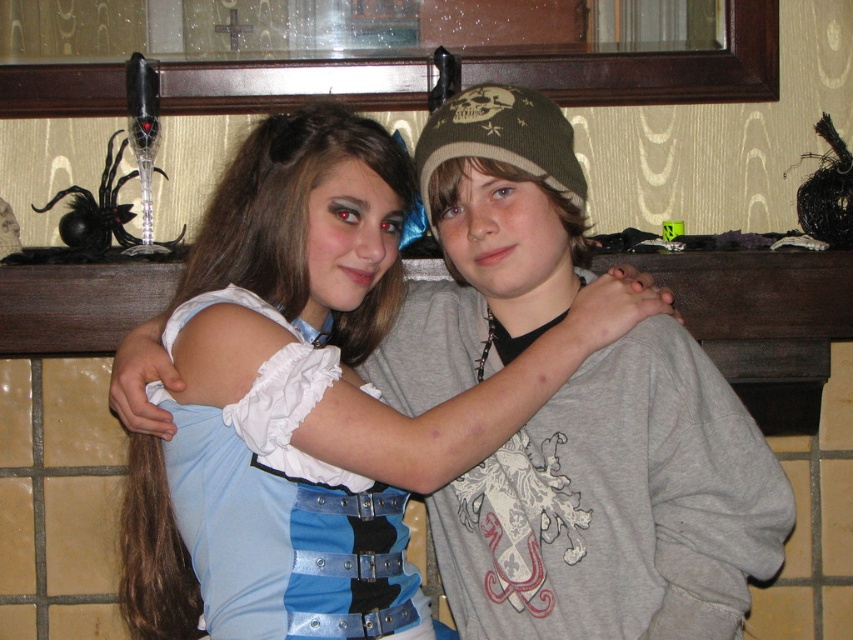
Question: Is blue satin dress at center wider than light blue fabric dress at center?

Choices:
 (A) no
 (B) yes

Answer: (B)

Question: Is gray cotton sweatshirt at center bigger than blue satin dress at center?

Choices:
 (A) no
 (B) yes

Answer: (A)

Question: Considering the relative positions of gray cotton sweatshirt at center and blue satin dress at center in the image provided, where is gray cotton sweatshirt at center located with respect to blue satin dress at center?

Choices:
 (A) left
 (B) right

Answer: (B)

Question: Which of the following is the closest to the observer?

Choices:
 (A) tap(239, 236)
 (B) tap(665, 525)

Answer: (A)

Question: Estimate the real-world distances between objects in this image. Which object is farther from the light blue fabric dress at center?

Choices:
 (A) gray cotton sweatshirt at center
 (B) blue satin dress at center

Answer: (A)

Question: Which object is farther from the camera taking this photo?

Choices:
 (A) gray cotton sweatshirt at center
 (B) blue satin dress at center
 (C) light blue fabric dress at center

Answer: (A)